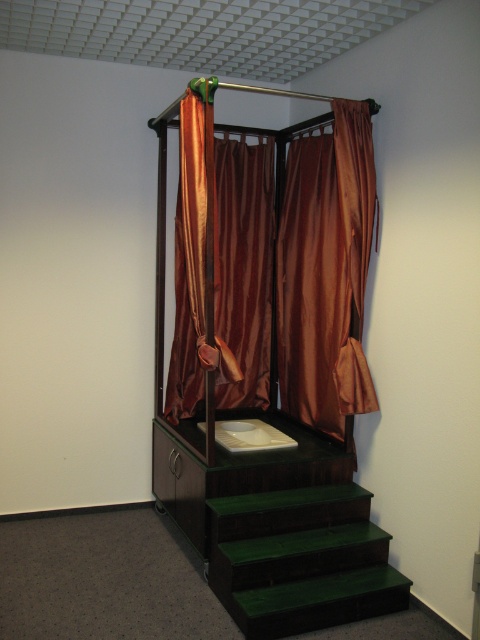
Is satin brown curtain at center above green matte/stained wood stairs at lower center?

Correct, satin brown curtain at center is located above green matte/stained wood stairs at lower center.

Is point (180, 339) farther from viewer compared to point (340, 560)?

Yes, point (180, 339) is farther from viewer.

At what (x,y) coordinates should I click in order to perform the action: click on satin brown curtain at center. Please return your answer as a coordinate pair (x, y). This screenshot has width=480, height=640. Looking at the image, I should click on (325, 272).